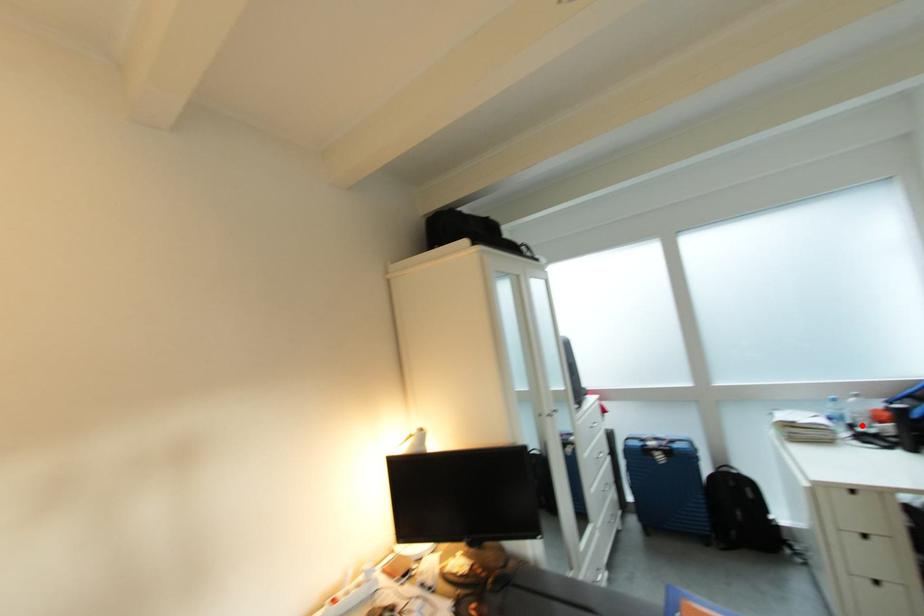
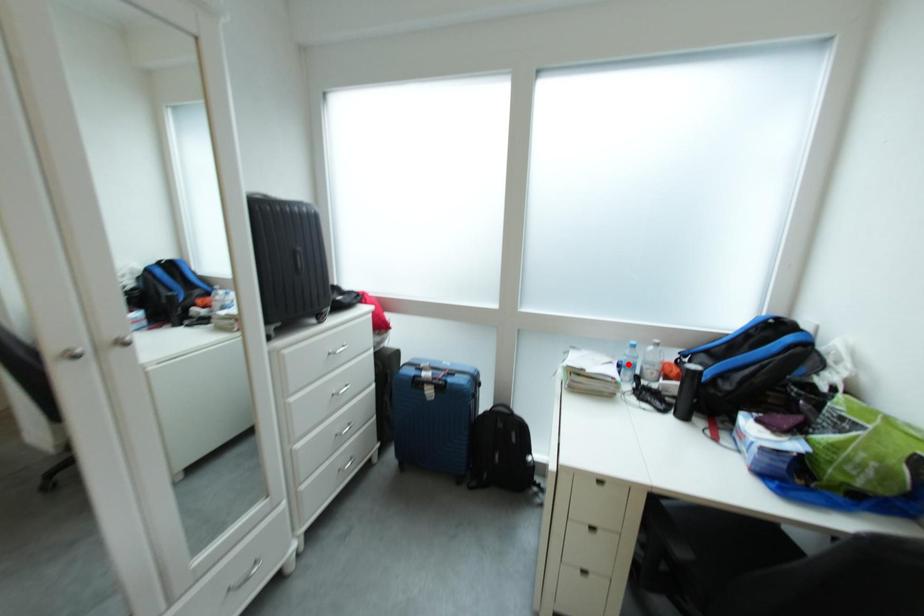
I am providing you with two images of the same scene from different viewpoints. A red point is marked on the first image and another point is marked on the second image. Are the points marked in image1 and image2 representing the same 3D position?

No